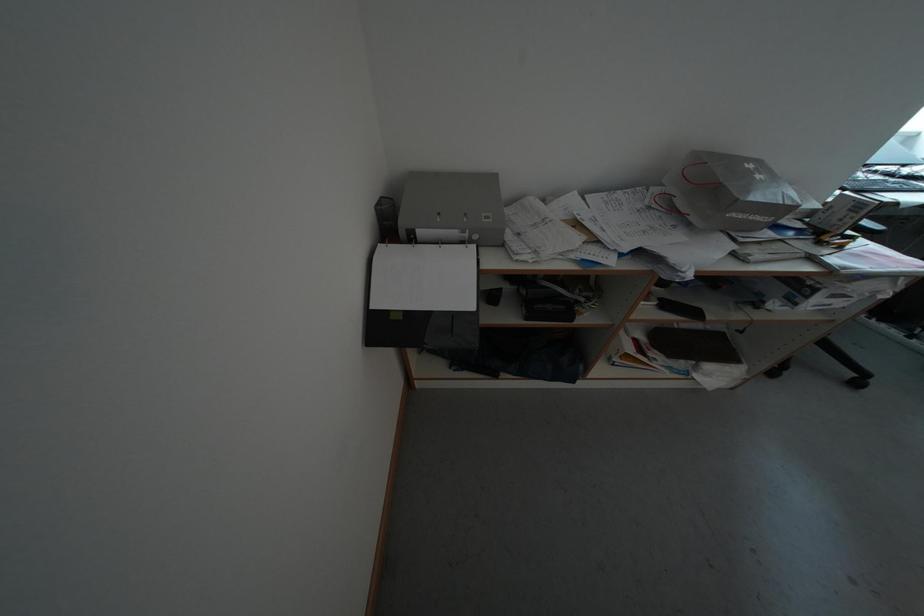
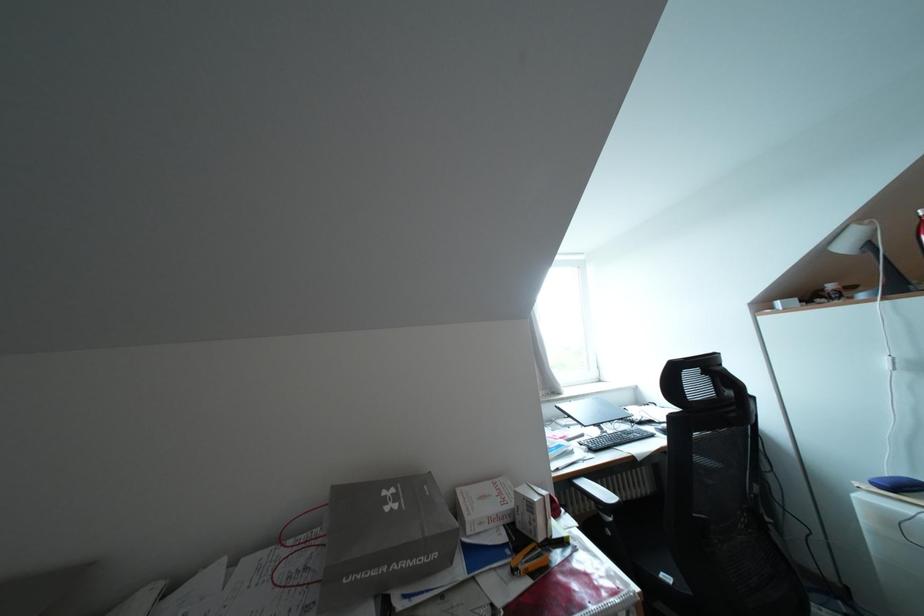
First-person continuous shooting, in which direction is the camera rotating?

The camera rotated toward right-up.